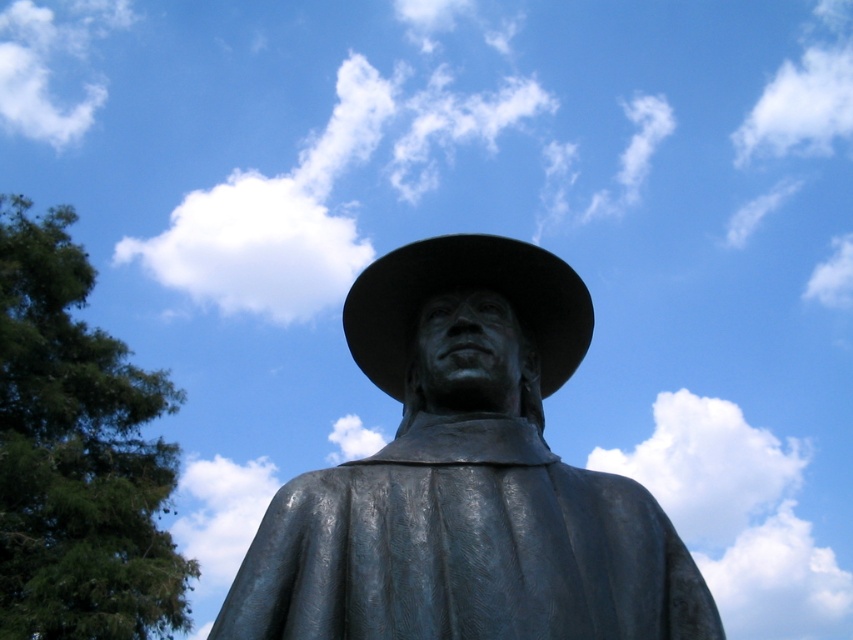
You are an artist sketching the statue and the cloud in the scene. Which object, the shiny black cowboy hat at center or the white fluffy cloud at upper left, is closer to the ground?

The shiny black cowboy hat at center is closer to the ground than the white fluffy cloud at upper left because it is shorter.

You are an artist planning to paint the scene. You want to ensure that the shiny black cowboy hat at center and the white fluffy cloud at upper left are proportionally accurate. Based on their sizes in the image, which object should you paint smaller?

The shiny black cowboy hat at center should be painted smaller because it occupies less space than the white fluffy cloud at upper left.

You are an artist planning to paint the scene with the bronze statue at center and the shiny black cowboy hat at center. You want to ensure the statue appears three dimensional. Which object should you place closer to the viewer to achieve this effect?

To make the bronze statue at center appear three dimensional, you should place it closer to the viewer than the shiny black cowboy hat at center, as it is already positioned in front of the hat in the scene.